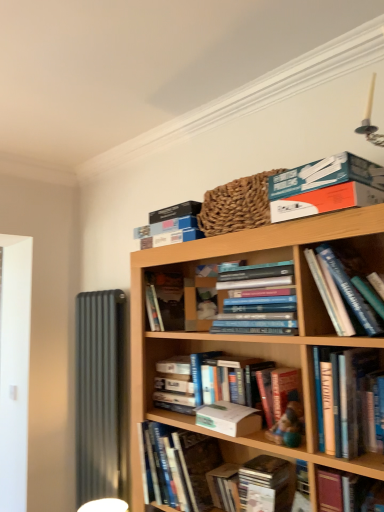
Question: Would you say wooden cd case at lower center, marked as the ninth book in a top-to-bottom arrangement, is to the left or to the right of blue cardboard box at upper center, which ranks as the 1th book in top-to-bottom order, in the picture?

Choices:
 (A) left
 (B) right

Answer: (A)

Question: Is point (233, 501) positioned closer to the camera than point (362, 197)?

Choices:
 (A) farther
 (B) closer

Answer: (A)

Question: Which object is the farthest from the blue cardboard box at upper center, the 2th book from the top?

Choices:
 (A) white paper at center, positioned as the 1th paperback book in front-to-back order
 (B) hardcover books at center, the 6th book from the bottom
 (C) hardcover book at center, acting as the second book starting from the bottom
 (D) blue cardboard box at upper center, the ninth book from the bottom
 (E) hardcover book at upper center, the third book from the top

Answer: (C)

Question: Which is farther from the white paper at center, which is counted as the 2th paperback book, starting from the top?

Choices:
 (A) hardcover book at center, which is counted as the 4th book, starting from the bottom
 (B) hardcover book at center, positioned as the 5th book in bottom-to-top order
 (C) hardcover book at upper center, the third book from the top
 (D) hardcover book at center, acting as the second book starting from the bottom
 (E) hardcover books at center, the 6th book from the bottom

Answer: (C)